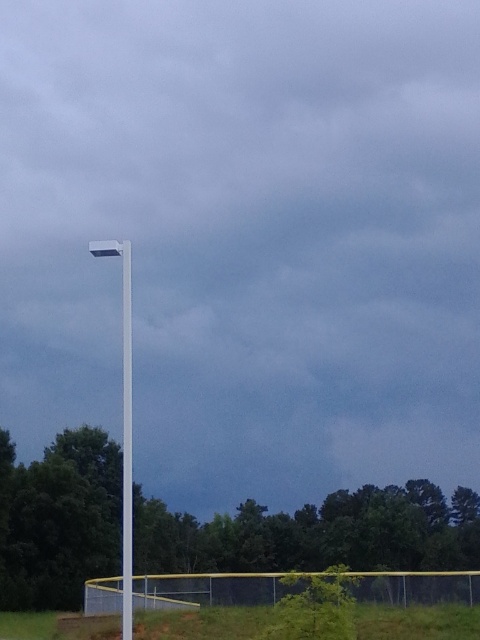
You are a maintenance worker who needs to replace a light fixture. You see two poles in the image, the white smooth pole at upper left and the white plastic pole at center. Which pole is closer to the left edge of the image?

The white smooth pole at upper left is positioned on the left side of the white plastic pole at center, so it is closer to the left edge of the image.